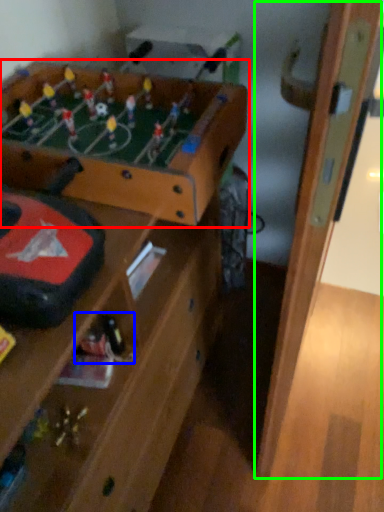
Question: Estimate the real-world distances between objects in this image. Which object is farther from table (highlighted by a red box), toy (highlighted by a blue box) or door (highlighted by a green box)?

Choices:
 (A) toy
 (B) door

Answer: (A)